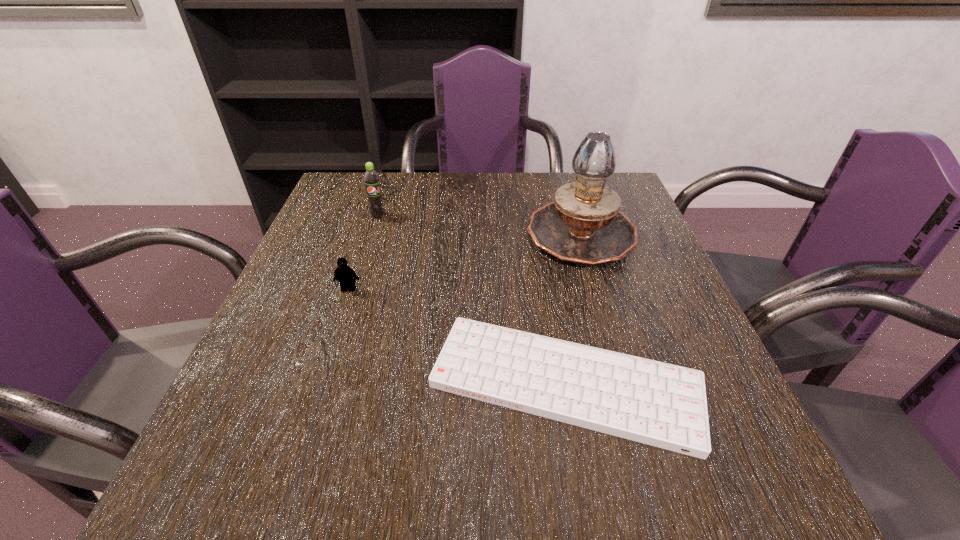
This screenshot has height=540, width=960. Find the location of `oil lamp`. oil lamp is located at coordinates (583, 225).

At what (x,y) coordinates should I click in order to perform the action: click on the third shortest object. Please return your answer as a coordinate pair (x, y). This screenshot has height=540, width=960. Looking at the image, I should click on tap(371, 178).

Identify the location of the third farthest object. This screenshot has height=540, width=960. (344, 274).

This screenshot has width=960, height=540. I want to click on Lego, so click(344, 274).

Locate an element on the screen. The height and width of the screenshot is (540, 960). the shortest object is located at coordinates (663, 405).

Identify the location of computer keyboard. The image size is (960, 540). (663, 405).

I want to click on free space located 0.050m on the left of the oil lamp, so click(x=506, y=233).

The width and height of the screenshot is (960, 540). Identify the location of vacant point located on the front label of the soda. (350, 305).

The height and width of the screenshot is (540, 960). Find the location of `vacant space located on the face of the third tallest object`. vacant space located on the face of the third tallest object is located at coordinates (303, 426).

Where is `vacant region located on the left of the shortest object`? The width and height of the screenshot is (960, 540). vacant region located on the left of the shortest object is located at coordinates 354,383.